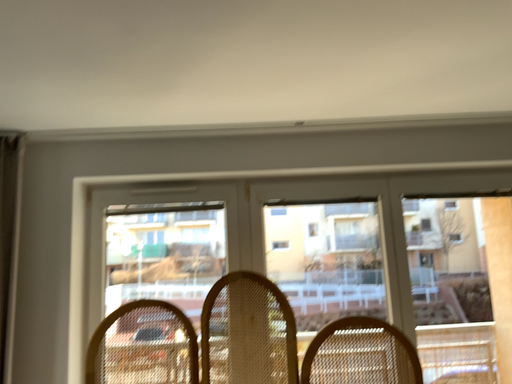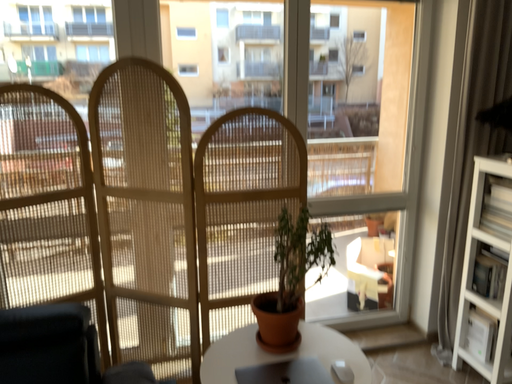
Question: Which way did the camera rotate in the video?

Choices:
 (A) rotated upward
 (B) rotated downward

Answer: (B)